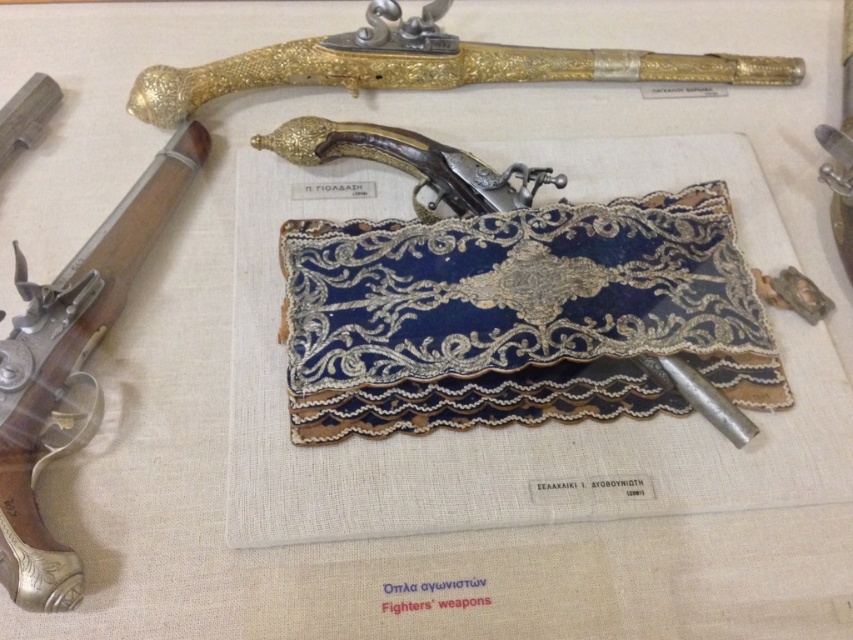
You are a museum curator arranging a new exhibit. You have the blue embroidered cloth at center and the gold textured pistol at upper center. Which object should you place first if you want to prioritize the larger item in the display?

The blue embroidered cloth at center is larger in size than the gold textured pistol at upper center, so you should place the blue embroidered cloth at center first to prioritize the larger item in the display.

You are a museum visitor standing in front of the display. You want to take a photo of the gold textured pistol at upper center without the blue embroidered cloth at center blocking the view. Is the pistol visible from your current position?

The blue embroidered cloth at center is closer to the viewer than the gold textured pistol at upper center, so the cloth may block the view of the pistol. Move closer or adjust your angle to ensure the pistol is visible without obstruction.

You are a museum visitor standing in front of the display. You want to take a photo of the polished silver handgun at left without any obstructions. Is the blue embroidered cloth at center blocking your view of the handgun?

The blue embroidered cloth at center is further to the viewer than the polished silver handgun at left, so it is closer to you and would block your view of the handgun. You need to move to a position where the cloth is not in front of the handgun.